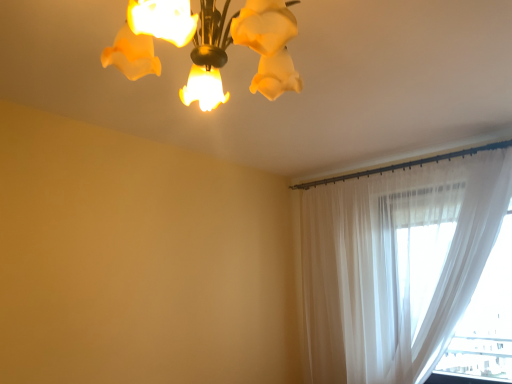
Question: Is matte glass chandelier at upper center shorter than sheer white curtain at right?

Choices:
 (A) yes
 (B) no

Answer: (A)

Question: Are matte glass chandelier at upper center and sheer white curtain at right located far from each other?

Choices:
 (A) no
 (B) yes

Answer: (B)

Question: From the image's perspective, is matte glass chandelier at upper center located beneath sheer white curtain at right?

Choices:
 (A) yes
 (B) no

Answer: (B)

Question: Considering the relative sizes of matte glass chandelier at upper center and sheer white curtain at right in the image provided, is matte glass chandelier at upper center bigger than sheer white curtain at right?

Choices:
 (A) no
 (B) yes

Answer: (A)

Question: Is matte glass chandelier at upper center to the right of sheer white curtain at right from the viewer's perspective?

Choices:
 (A) no
 (B) yes

Answer: (A)

Question: From a real-world perspective, is matte glass chandelier at upper center below sheer white curtain at right?

Choices:
 (A) no
 (B) yes

Answer: (A)

Question: Is sheer white curtain at right behind matte glass chandelier at upper center?

Choices:
 (A) yes
 (B) no

Answer: (A)

Question: Would you say sheer white curtain at right contains matte glass chandelier at upper center?

Choices:
 (A) yes
 (B) no

Answer: (B)

Question: Could you tell me if sheer white curtain at right is turned towards matte glass chandelier at upper center?

Choices:
 (A) yes
 (B) no

Answer: (A)

Question: Considering the relative sizes of sheer white curtain at right and matte glass chandelier at upper center in the image provided, is sheer white curtain at right shorter than matte glass chandelier at upper center?

Choices:
 (A) yes
 (B) no

Answer: (B)

Question: Would you consider sheer white curtain at right to be distant from matte glass chandelier at upper center?

Choices:
 (A) no
 (B) yes

Answer: (B)

Question: Considering the relative sizes of sheer white curtain at right and matte glass chandelier at upper center in the image provided, is sheer white curtain at right wider than matte glass chandelier at upper center?

Choices:
 (A) no
 (B) yes

Answer: (A)

Question: Choose the correct answer: Is sheer white curtain at right inside matte glass chandelier at upper center or outside it?

Choices:
 (A) inside
 (B) outside

Answer: (B)